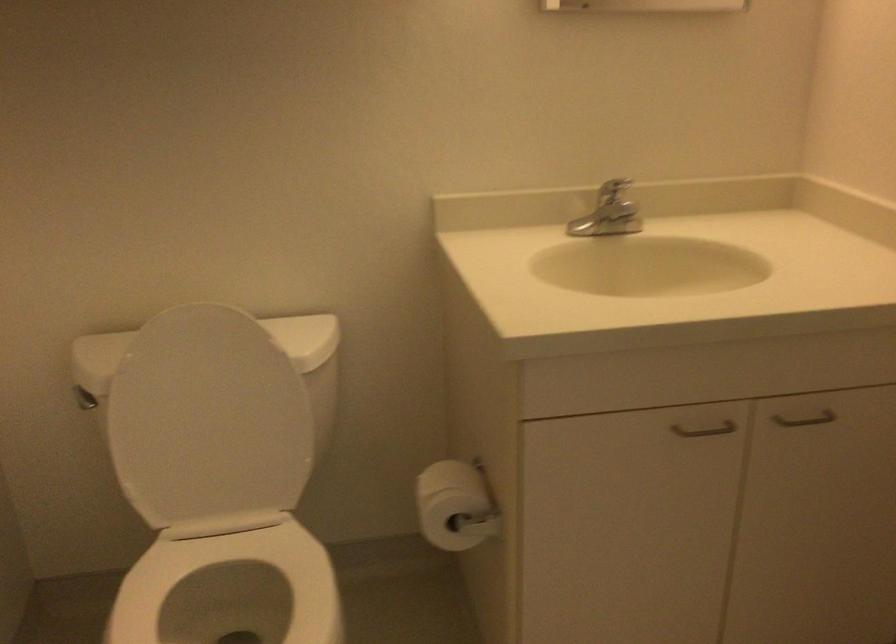
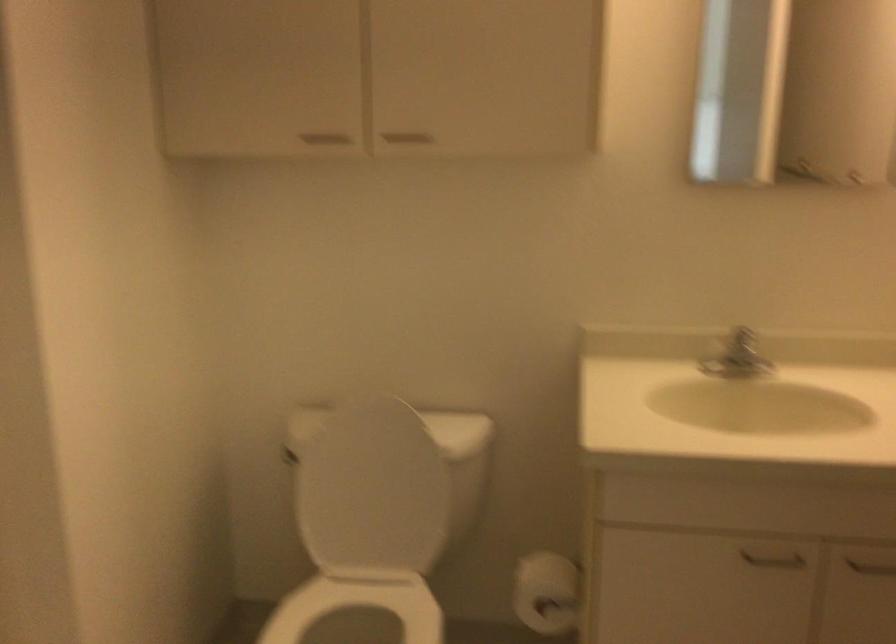
Locate, in the second image, the point that corresponds to point 452,507 in the first image.

(547, 592)